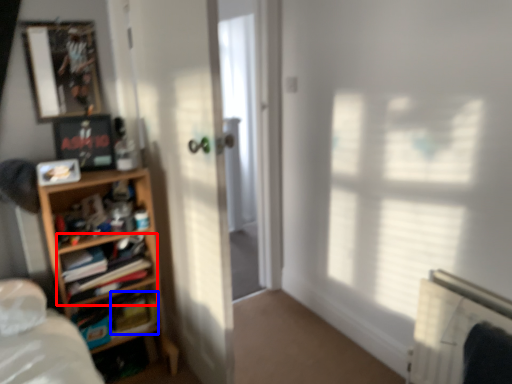
Question: Which point is further to the camera, shelf (highlighted by a red box) or paperback book (highlighted by a blue box)?

Choices:
 (A) shelf
 (B) paperback book

Answer: (B)